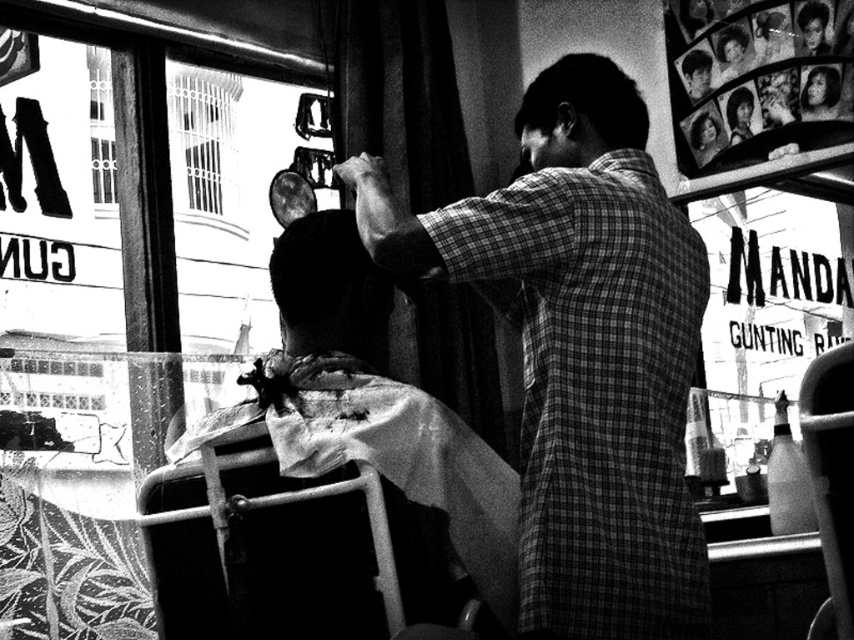
Does checkered fabric shirt at center appear under metallic white chair at center?

Incorrect, checkered fabric shirt at center is not positioned below metallic white chair at center.

Which of these two, checkered fabric shirt at center or metallic white chair at center, stands shorter?

With less height is metallic white chair at center.

Identify the location of checkered fabric shirt at center. Image resolution: width=854 pixels, height=640 pixels. tap(583, 352).

Find the location of `checkered fabric shirt at center`. checkered fabric shirt at center is located at coordinates click(583, 352).

Does checkered fabric shirt at center have a smaller size compared to metallic silver chair at lower center?

Incorrect, checkered fabric shirt at center is not smaller in size than metallic silver chair at lower center.

Is point (654, 445) farther from viewer compared to point (256, 547)?

Yes, it is behind point (256, 547).

Locate an element on the screen. The image size is (854, 640). checkered fabric shirt at center is located at coordinates 583,352.

Is metallic silver chair at lower center positioned before short hair at upper center?

Yes, metallic silver chair at lower center is in front of short hair at upper center.

Where is `metallic silver chair at lower center`? The width and height of the screenshot is (854, 640). metallic silver chair at lower center is located at coordinates (290, 550).

The height and width of the screenshot is (640, 854). Find the location of `metallic silver chair at lower center`. metallic silver chair at lower center is located at coordinates (290, 550).